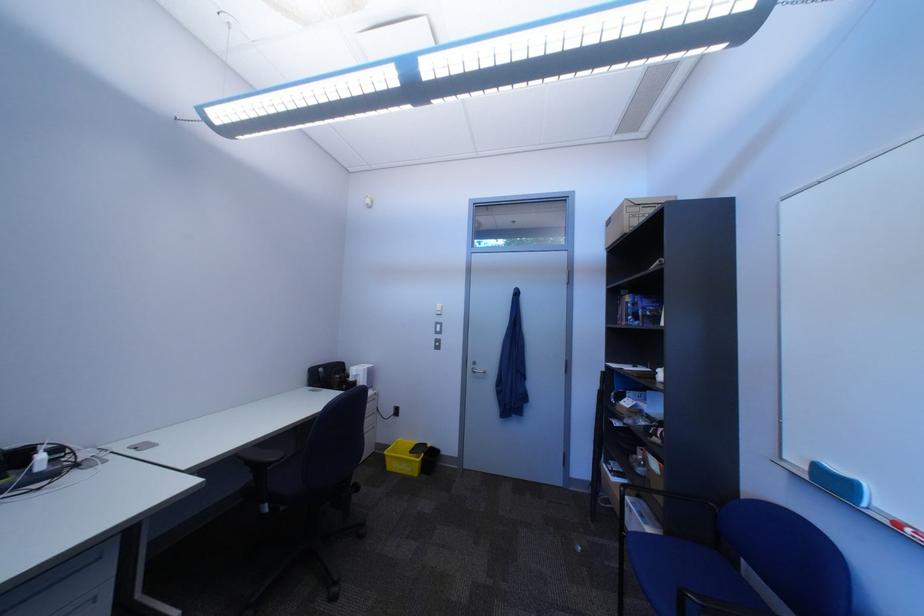
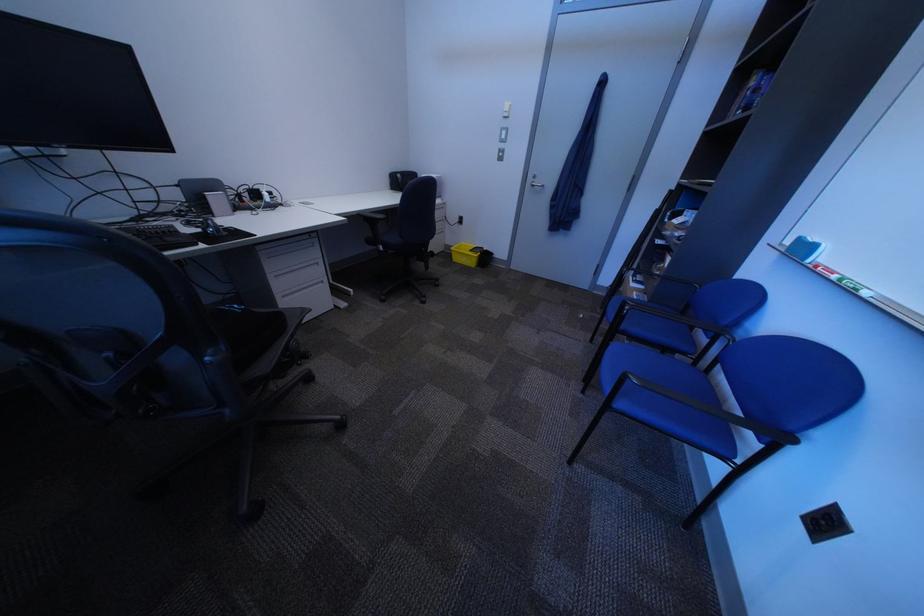
First-person continuous shooting, in which direction is the camera rotating?

The rotation direction of the camera is left-down.